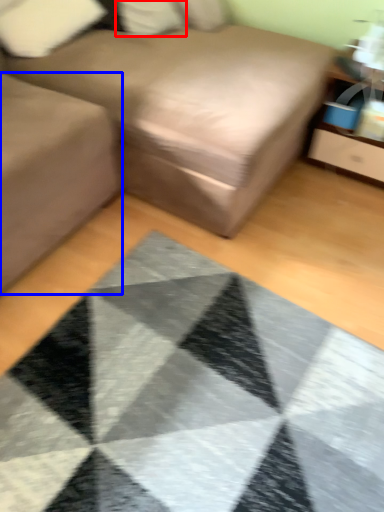
Question: Which object appears closest to the camera in this image, pillow (highlighted by a red box) or gray (highlighted by a blue box)?

Choices:
 (A) pillow
 (B) gray

Answer: (B)